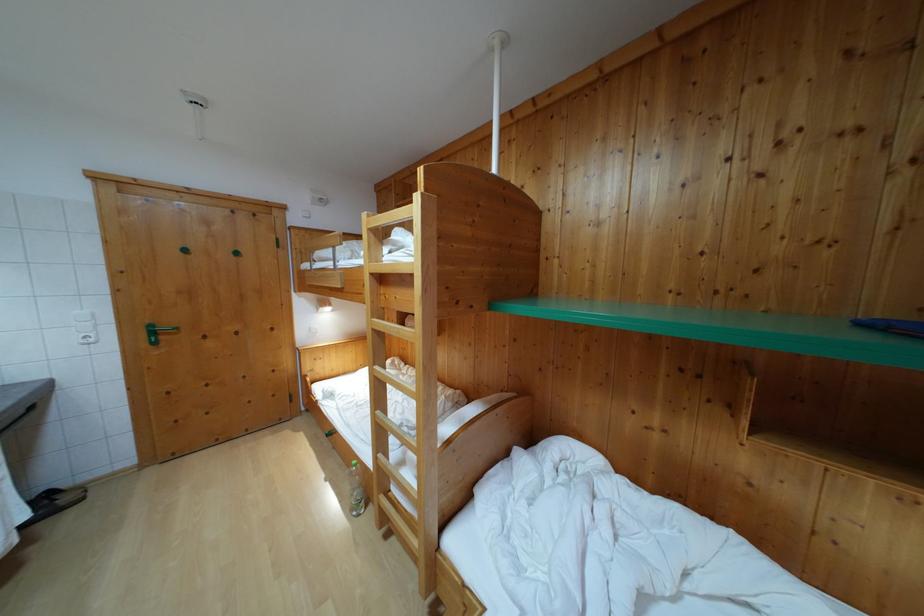
What do you see at coordinates (356, 490) in the screenshot?
I see `a clear plastic bottle` at bounding box center [356, 490].